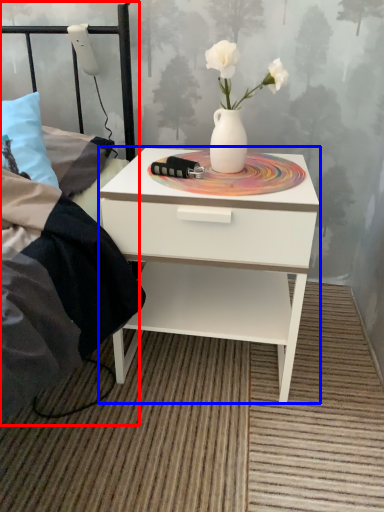
Question: Among these objects, which one is farthest to the camera, bed frame (highlighted by a red box) or nightstand (highlighted by a blue box)?

Choices:
 (A) bed frame
 (B) nightstand

Answer: (B)